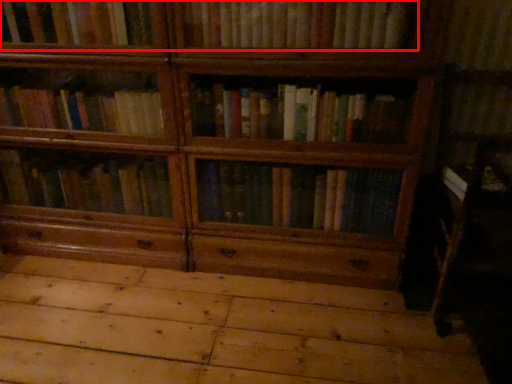
Question: From the image's perspective, where is book (annotated by the red box) located relative to plywood?

Choices:
 (A) below
 (B) above

Answer: (B)